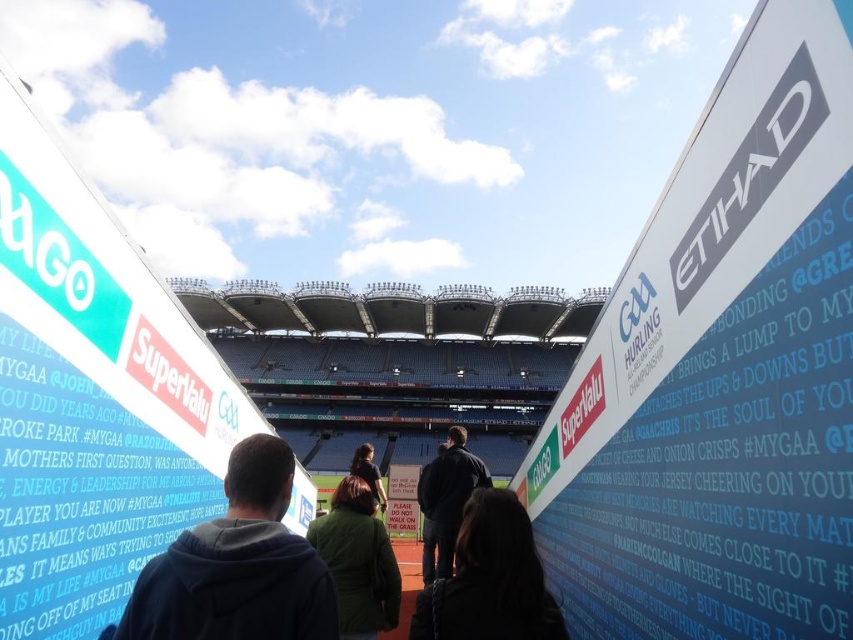
Does white plastic sign at right appear under green matte jacket at center?

Actually, white plastic sign at right is above green matte jacket at center.

Is white plastic sign at right thinner than green matte jacket at center?

Yes, white plastic sign at right is thinner than green matte jacket at center.

Find the location of a particular element. This screenshot has height=640, width=853. white plastic sign at right is located at coordinates (721, 372).

The image size is (853, 640). Identify the location of white plastic sign at right. (721, 372).

Does white plastic sign at right have a greater height compared to dark blue hoodie at center?

Indeed, white plastic sign at right has a greater height compared to dark blue hoodie at center.

Does white plastic sign at right have a lesser width compared to dark blue hoodie at center?

Indeed, white plastic sign at right has a lesser width compared to dark blue hoodie at center.

Is point (769, 49) in front of point (236, 552)?

Yes, it is.

The width and height of the screenshot is (853, 640). I want to click on white plastic sign at right, so click(x=721, y=372).

Does dark blue hoodie at center have a lesser width compared to green matte jacket at center?

No, dark blue hoodie at center is not thinner than green matte jacket at center.

Can you confirm if dark blue hoodie at center is shorter than green matte jacket at center?

Correct, dark blue hoodie at center is not as tall as green matte jacket at center.

This screenshot has height=640, width=853. Describe the element at coordinates (236, 564) in the screenshot. I see `dark blue hoodie at center` at that location.

What are the coordinates of `dark blue hoodie at center` in the screenshot? It's located at (x=236, y=564).